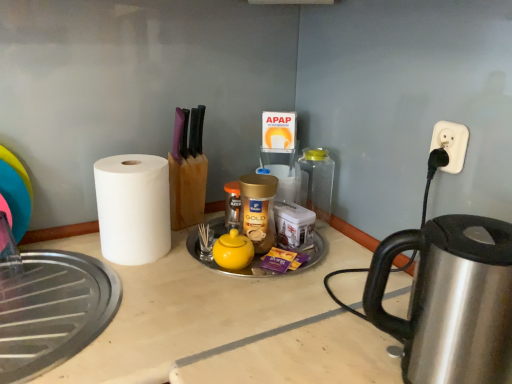
Question: Does satin silver kettle at right touch white plastic outlet at upper right?

Choices:
 (A) no
 (B) yes

Answer: (A)

Question: Does satin silver kettle at right appear on the right side of white plastic outlet at upper right?

Choices:
 (A) yes
 (B) no

Answer: (B)

Question: Is white plastic outlet at upper right a part of satin silver kettle at right?

Choices:
 (A) yes
 (B) no

Answer: (B)

Question: From the image's perspective, is satin silver kettle at right on top of white plastic outlet at upper right?

Choices:
 (A) yes
 (B) no

Answer: (B)

Question: Considering the relative sizes of satin silver kettle at right and white plastic outlet at upper right in the image provided, is satin silver kettle at right wider than white plastic outlet at upper right?

Choices:
 (A) no
 (B) yes

Answer: (B)

Question: In the image, is white plastic outlet at upper right on the left side or the right side of satin silver kettle at right?

Choices:
 (A) left
 (B) right

Answer: (B)

Question: From the image's perspective, relative to satin silver kettle at right, is white plastic outlet at upper right above or below?

Choices:
 (A) above
 (B) below

Answer: (A)

Question: Based on their sizes in the image, would you say white plastic outlet at upper right is bigger or smaller than satin silver kettle at right?

Choices:
 (A) big
 (B) small

Answer: (B)

Question: Considering their positions, is white plastic outlet at upper right located in front of or behind satin silver kettle at right?

Choices:
 (A) behind
 (B) front

Answer: (A)

Question: From a real-world perspective, is white matte paper towel at left positioned above or below transparent glass jar at center?

Choices:
 (A) above
 (B) below

Answer: (B)

Question: Is white matte paper towel at left taller or shorter than transparent glass jar at center?

Choices:
 (A) tall
 (B) short

Answer: (A)

Question: Based on their sizes in the image, would you say white matte paper towel at left is bigger or smaller than transparent glass jar at center?

Choices:
 (A) big
 (B) small

Answer: (A)

Question: From the image's perspective, is white matte paper towel at left above or below transparent glass jar at center?

Choices:
 (A) above
 (B) below

Answer: (B)

Question: Based on their positions, is transparent glass jar at center located to the left or right of yellow matte tea pot at center?

Choices:
 (A) right
 (B) left

Answer: (A)

Question: Is point (310, 198) closer or farther from the camera than point (227, 238)?

Choices:
 (A) closer
 (B) farther

Answer: (B)